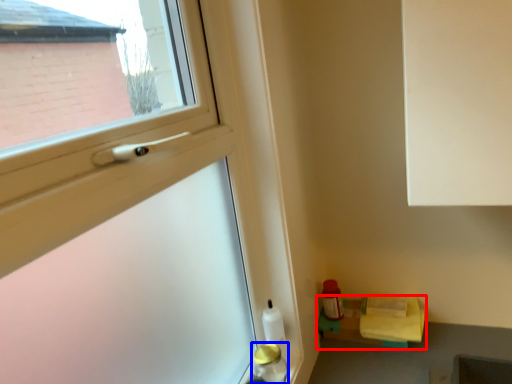
Question: Which point is further to the camera, shelf (highlighted by a red box) or bottle (highlighted by a blue box)?

Choices:
 (A) shelf
 (B) bottle

Answer: (A)